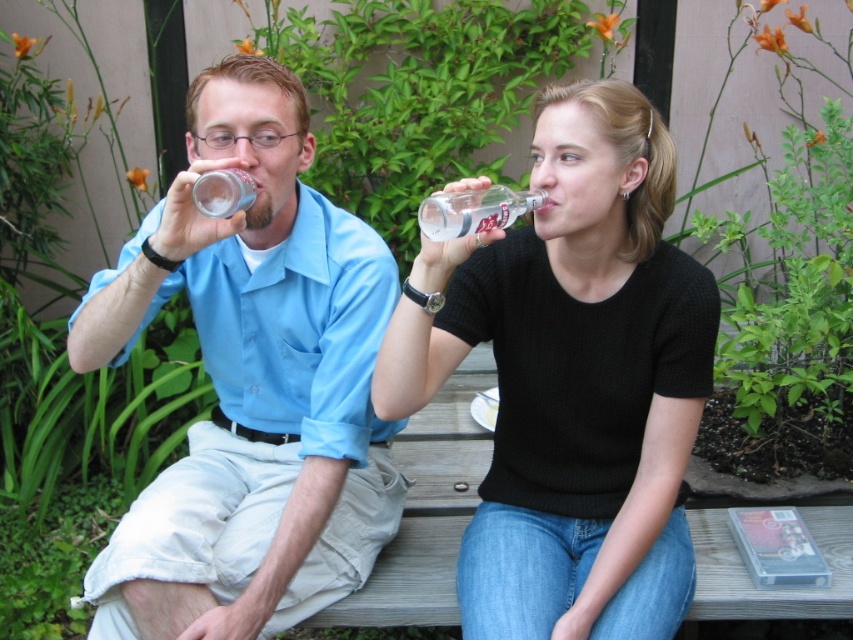
Is point (544, 605) behind point (471, 205)?

Yes, point (544, 605) is farther from viewer.

Does black matte water bottle at upper center appear on the left side of clear plastic bottle at upper center?

Incorrect, black matte water bottle at upper center is not on the left side of clear plastic bottle at upper center.

Measure the distance between point (593, 540) and camera.

Point (593, 540) and camera are 1.41 meters apart from each other.

This screenshot has width=853, height=640. Identify the location of black matte water bottle at upper center. (572, 380).

At what (x,y) coordinates should I click in order to perform the action: click on matte plastic bottle at left. Please return your answer as a coordinate pair (x, y). The image size is (853, 640). Looking at the image, I should click on (252, 381).

Is matte plastic bottle at left thinner than clear plastic bottle at upper center?

No.

This screenshot has height=640, width=853. In order to click on matte plastic bottle at left in this screenshot , I will do `click(252, 381)`.

Can you confirm if black matte water bottle at upper center is thinner than clear glass bottle at upper center?

Incorrect, black matte water bottle at upper center's width is not less than clear glass bottle at upper center's.

Does black matte water bottle at upper center have a greater height compared to clear glass bottle at upper center?

Indeed, black matte water bottle at upper center has a greater height compared to clear glass bottle at upper center.

Is point (596, 522) closer to camera compared to point (194, 188)?

No, it is behind (194, 188).

You are a GUI agent. You are given a task and a screenshot of the screen. Output one action in this format:
    pyautogui.click(x=<x>, y=<y>)
    Task: Click on the black matte water bottle at upper center
    
    Given the screenshot: What is the action you would take?
    pyautogui.click(x=572, y=380)